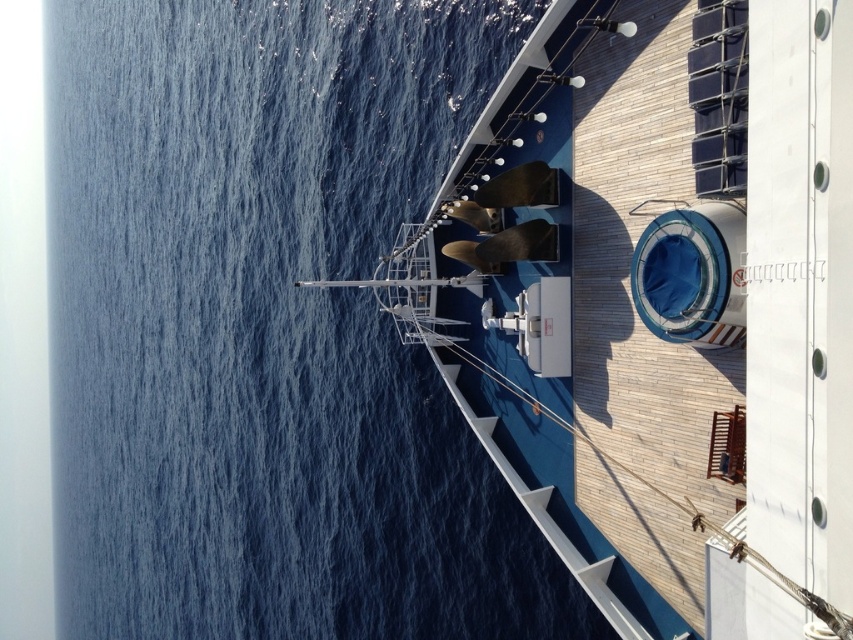
Question: Is blue water at upper left to the left of white glossy boat at upper center from the viewer's perspective?

Choices:
 (A) yes
 (B) no

Answer: (A)

Question: Can you confirm if blue water at upper left is smaller than white glossy boat at upper center?

Choices:
 (A) no
 (B) yes

Answer: (A)

Question: Is blue water at upper left positioned behind white glossy boat at upper center?

Choices:
 (A) no
 (B) yes

Answer: (B)

Question: Which object is farther from the camera taking this photo?

Choices:
 (A) white glossy boat at upper center
 (B) blue water at upper left

Answer: (B)